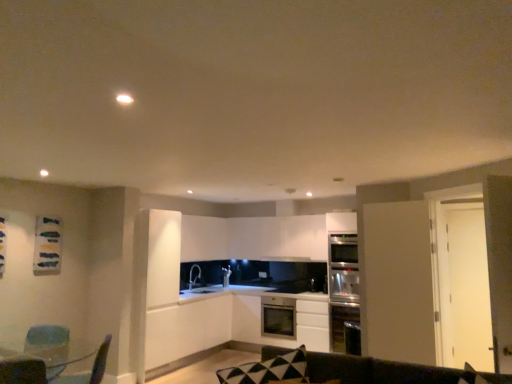
Question: From a real-world perspective, is metallic blue swivel chair at lower left, the second swivel chair when ordered from left to right, under satin silver oven at right?

Choices:
 (A) yes
 (B) no

Answer: (A)

Question: Are metallic blue swivel chair at lower left, the second swivel chair when ordered from left to right, and satin silver oven at right far apart?

Choices:
 (A) yes
 (B) no

Answer: (A)

Question: Is metallic blue swivel chair at lower left, which is the first swivel chair in right-to-left order, looking in the opposite direction of satin silver oven at right?

Choices:
 (A) no
 (B) yes

Answer: (A)

Question: Does metallic blue swivel chair at lower left, the second swivel chair when ordered from left to right, have a greater height compared to satin silver oven at right?

Choices:
 (A) yes
 (B) no

Answer: (B)

Question: Considering the relative sizes of metallic blue swivel chair at lower left, the second swivel chair when ordered from left to right, and satin silver oven at right in the image provided, is metallic blue swivel chair at lower left, the second swivel chair when ordered from left to right, shorter than satin silver oven at right?

Choices:
 (A) yes
 (B) no

Answer: (A)

Question: Is metallic blue swivel chair at lower left, which is the first swivel chair in right-to-left order, positioned behind satin silver oven at right?

Choices:
 (A) no
 (B) yes

Answer: (A)

Question: From a real-world perspective, is stainless steel oven at center, the 3th cabinetry viewed from the top, physically above green fabric swivel chair at lower left, arranged as the 2th swivel chair when viewed from the right?

Choices:
 (A) no
 (B) yes

Answer: (A)

Question: Can you confirm if stainless steel oven at center, which is the first cabinetry in bottom-to-top order, is thinner than green fabric swivel chair at lower left, the first swivel chair in the left-to-right sequence?

Choices:
 (A) no
 (B) yes

Answer: (A)

Question: From the image's perspective, would you say stainless steel oven at center, the 3th cabinetry viewed from the top, is positioned over green fabric swivel chair at lower left, arranged as the 2th swivel chair when viewed from the right?

Choices:
 (A) yes
 (B) no

Answer: (B)

Question: Does stainless steel oven at center, which is the first cabinetry in bottom-to-top order, have a lesser height compared to green fabric swivel chair at lower left, arranged as the 2th swivel chair when viewed from the right?

Choices:
 (A) no
 (B) yes

Answer: (A)

Question: Does stainless steel oven at center, which is the first cabinetry in bottom-to-top order, have a larger size compared to green fabric swivel chair at lower left, the first swivel chair in the left-to-right sequence?

Choices:
 (A) yes
 (B) no

Answer: (A)

Question: From a real-world perspective, is stainless steel oven at center, the 3th cabinetry viewed from the top, located beneath green fabric swivel chair at lower left, the first swivel chair in the left-to-right sequence?

Choices:
 (A) yes
 (B) no

Answer: (A)

Question: Is dark brown leather couch at lower center taller than green fabric swivel chair at lower left, the first swivel chair in the left-to-right sequence?

Choices:
 (A) no
 (B) yes

Answer: (A)